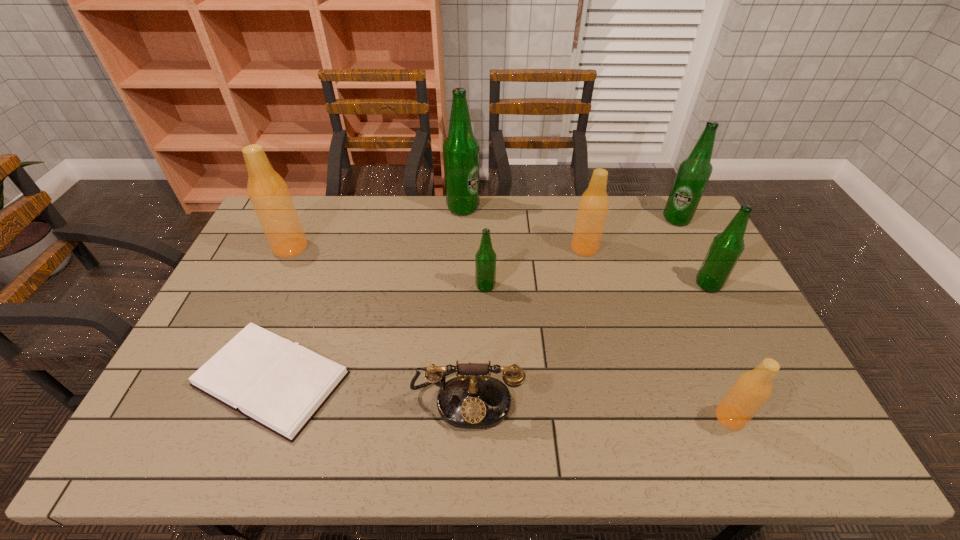
I want to click on vacant space in between the shortest object and the second biggest tan beer bottle, so click(428, 313).

Locate an element on the screen. the sixth closest object to the telephone is located at coordinates (726, 248).

Select which object is the fifth closest to the second biggest green beer bottle. Please provide its 2D coordinates. Your answer should be formatted as a tuple, i.e. [(x, y)], where the tuple contains the x and y coordinates of a point satisfying the conditions above.

[(751, 390)]

Locate an element on the screen. beer bottle that is the fourth closest one to the telephone is located at coordinates (269, 194).

Where is `beer bottle that is the seventh closest to the eighth tallest object`? The image size is (960, 540). beer bottle that is the seventh closest to the eighth tallest object is located at coordinates (693, 174).

Point out which green beer bottle is positioned as the second nearest to the second smallest green beer bottle. Please provide its 2D coordinates. Your answer should be formatted as a tuple, i.e. [(x, y)], where the tuple contains the x and y coordinates of a point satisfying the conditions above.

[(485, 259)]

Locate which green beer bottle is the second closest to the second biggest green beer bottle. Please provide its 2D coordinates. Your answer should be formatted as a tuple, i.e. [(x, y)], where the tuple contains the x and y coordinates of a point satisfying the conditions above.

[(460, 149)]

I want to click on tan beer bottle that is the third nearest to the smallest green beer bottle, so click(x=751, y=390).

Identify which tan beer bottle is the third closest to the eighth tallest object. Please provide its 2D coordinates. Your answer should be formatted as a tuple, i.e. [(x, y)], where the tuple contains the x and y coordinates of a point satisfying the conditions above.

[(269, 194)]

Where is `vacant space that satisfies the following two spatial constraints: 1. on the label of the tallest beer bottle; 2. on the front side of the hardback book`? Image resolution: width=960 pixels, height=540 pixels. vacant space that satisfies the following two spatial constraints: 1. on the label of the tallest beer bottle; 2. on the front side of the hardback book is located at coordinates click(x=455, y=379).